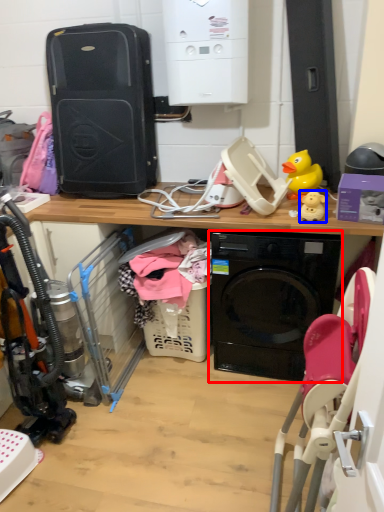
Question: Which object appears farthest to the camera in this image, washing machine (highlighted by a red box) or toy (highlighted by a blue box)?

Choices:
 (A) washing machine
 (B) toy

Answer: (B)